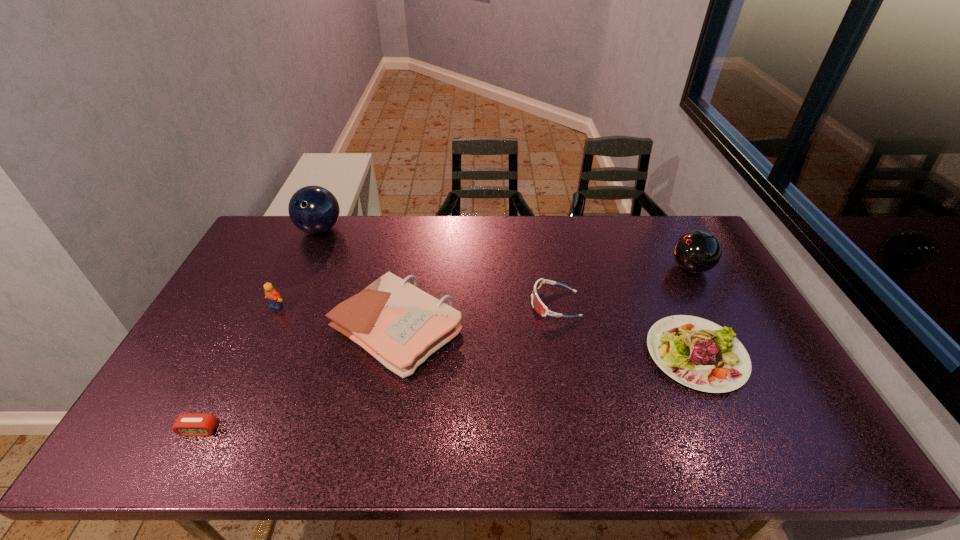
The height and width of the screenshot is (540, 960). Identify the location of the nearest object. (186, 424).

Identify the location of blank area located 0.360m on the surface of the tallest object near the finger holes. The image size is (960, 540). (279, 319).

You are a GUI agent. You are given a task and a screenshot of the screen. Output one action in this format:
    pyautogui.click(x=<x>, y=<y>)
    Task: Click on the vacant space located on the surface of the shorter bowling ball near the finger holes
    
    Given the screenshot: What is the action you would take?
    pyautogui.click(x=639, y=268)

The image size is (960, 540). I want to click on free space located on the surface of the shorter bowling ball near the finger holes, so click(610, 268).

Image resolution: width=960 pixels, height=540 pixels. In order to click on blank area located on the surface of the shorter bowling ball near the finger holes in this screenshot , I will do `click(631, 268)`.

Identify the location of vacant space located 0.290m on the front-facing side of the third tallest object. (235, 393).

Locate an element on the screen. free point located 0.210m on the right of the fourth object from right to left is located at coordinates (536, 329).

Locate an element on the screen. vacant space located 0.180m on the front-facing side of the goggles is located at coordinates (471, 303).

At what (x,y) coordinates should I click in order to perform the action: click on vacant space situated on the front-facing side of the goggles. Please return your answer as a coordinate pair (x, y). Looking at the image, I should click on (492, 303).

You are a GUI agent. You are given a task and a screenshot of the screen. Output one action in this format:
    pyautogui.click(x=<x>, y=<y>)
    Task: Click on the free space located on the front-facing side of the goggles
    
    Given the screenshot: What is the action you would take?
    pyautogui.click(x=439, y=303)